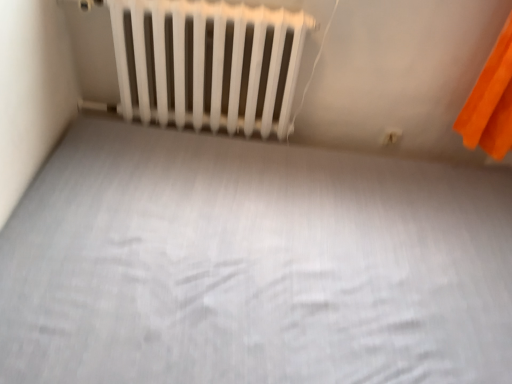
Question: Can white matte bed frame at center be found inside white plastic electric outlet at upper right?

Choices:
 (A) no
 (B) yes

Answer: (A)

Question: Is white plastic electric outlet at upper right wider than white matte bed frame at center?

Choices:
 (A) no
 (B) yes

Answer: (A)

Question: Is white plastic electric outlet at upper right positioned behind white matte bed frame at center?

Choices:
 (A) yes
 (B) no

Answer: (A)

Question: Does white plastic electric outlet at upper right touch white matte bed frame at center?

Choices:
 (A) yes
 (B) no

Answer: (B)

Question: From a real-world perspective, is white plastic electric outlet at upper right positioned under white matte bed frame at center based on gravity?

Choices:
 (A) yes
 (B) no

Answer: (B)

Question: Is white plastic electric outlet at upper right wider or thinner than white matte radiator at upper center?

Choices:
 (A) wide
 (B) thin

Answer: (B)

Question: Based on their positions, is white plastic electric outlet at upper right located to the left or right of white matte radiator at upper center?

Choices:
 (A) right
 (B) left

Answer: (A)

Question: Choose the correct answer: Is white plastic electric outlet at upper right inside white matte radiator at upper center or outside it?

Choices:
 (A) inside
 (B) outside

Answer: (B)

Question: From a real-world perspective, is white plastic electric outlet at upper right physically located above or below white matte radiator at upper center?

Choices:
 (A) below
 (B) above

Answer: (A)

Question: In terms of width, does white matte bed frame at center look wider or thinner when compared to white matte radiator at upper center?

Choices:
 (A) wide
 (B) thin

Answer: (A)

Question: From a real-world perspective, is white matte bed frame at center above or below white matte radiator at upper center?

Choices:
 (A) above
 (B) below

Answer: (B)

Question: Is white matte bed frame at center taller or shorter than white matte radiator at upper center?

Choices:
 (A) tall
 (B) short

Answer: (B)

Question: Based on their sizes in the image, would you say white matte bed frame at center is bigger or smaller than white matte radiator at upper center?

Choices:
 (A) big
 (B) small

Answer: (A)

Question: Is white matte bed frame at center spatially inside white plastic electric outlet at upper right, or outside of it?

Choices:
 (A) outside
 (B) inside

Answer: (A)

Question: From a real-world perspective, is white matte bed frame at center physically located above or below white plastic electric outlet at upper right?

Choices:
 (A) below
 (B) above

Answer: (A)